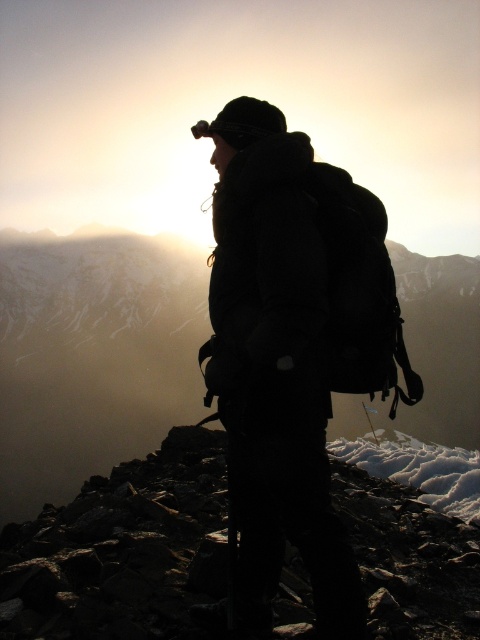
You are a hiker who wants to place your backpack on a stable surface. Based on the scene, can you determine if the smooth rock at center is a suitable place to put your backpack?

The smooth rock at center is located at point coordinates that do not provide information about its stability. However, since it is described as a smooth rock, it might have a flat surface suitable for placing a backpack. But without details on its size or sturdiness, it is uncertain. The scene mentions the rocky mountain peak environment, so caution is advised.

You are a hiker who wants to place your backpack on a stable surface. Given the smooth rock at center and the rough stone at center, which one is more suitable for placing your backpack?

The smooth rock at center is much taller than the rough stone at center, so the smooth rock at center is more suitable for placing your backpack as it provides a more stable surface due to its height and stability.